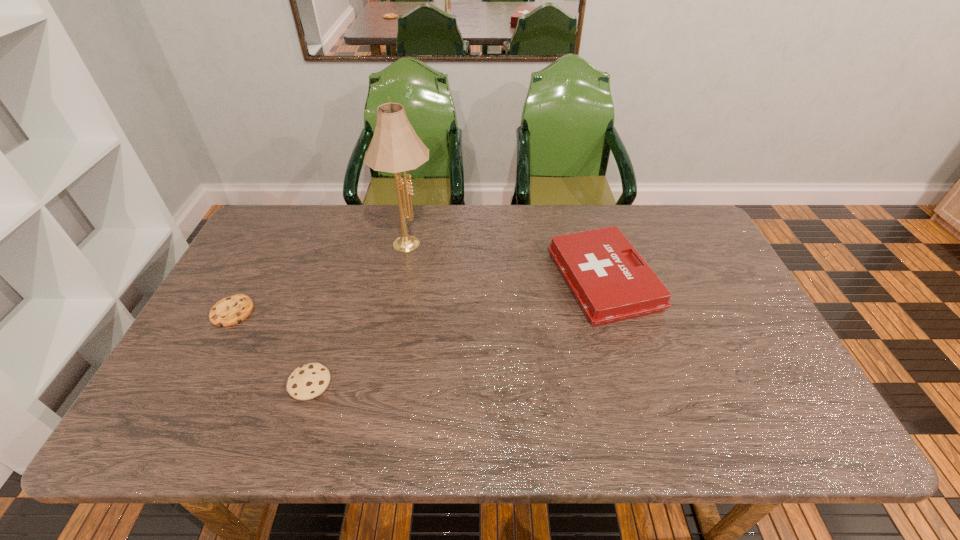
The image size is (960, 540). I want to click on vacant space at the near left corner of the desktop, so click(x=170, y=410).

Image resolution: width=960 pixels, height=540 pixels. In order to click on unoccupied area between the third tallest object and the lampshade in this screenshot , I will do `click(359, 312)`.

Where is `unoccupied position between the third tallest object and the second tallest object`? This screenshot has width=960, height=540. unoccupied position between the third tallest object and the second tallest object is located at coordinates (457, 332).

Where is `free space between the shorter cookie and the first-aid kit`? The width and height of the screenshot is (960, 540). free space between the shorter cookie and the first-aid kit is located at coordinates (419, 295).

Locate an element on the screen. The image size is (960, 540). vacant region between the second object from right to left and the first-aid kit is located at coordinates (506, 260).

Locate an element on the screen. The height and width of the screenshot is (540, 960). vacant area that lies between the lampshade and the farther cookie is located at coordinates (321, 276).

Where is `free space between the third tallest object and the rightmost object`? The image size is (960, 540). free space between the third tallest object and the rightmost object is located at coordinates (457, 332).

Find the location of `vacant space in between the shortest object and the rightmost object`. vacant space in between the shortest object and the rightmost object is located at coordinates (419, 295).

Identify the location of vacant area that lies between the rightmost object and the nearer cookie. The height and width of the screenshot is (540, 960). (457, 332).

You are a GUI agent. You are given a task and a screenshot of the screen. Output one action in this format:
    pyautogui.click(x=<x>, y=<y>)
    Task: Click on the vacant area that lies between the first-aid kit and the shorter cookie
    This screenshot has height=540, width=960.
    Given the screenshot: What is the action you would take?
    pyautogui.click(x=419, y=295)